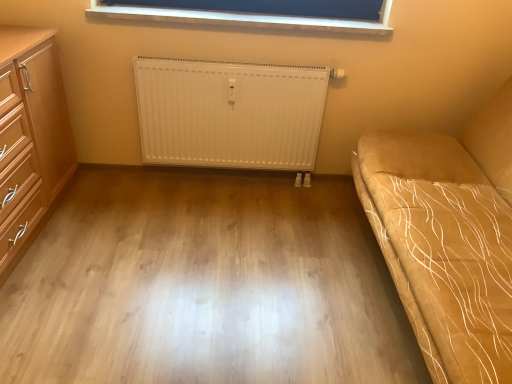
The width and height of the screenshot is (512, 384). In order to click on vacant space underneath white ribbed radiator at center (from a real-world perspective) in this screenshot , I will do `click(233, 179)`.